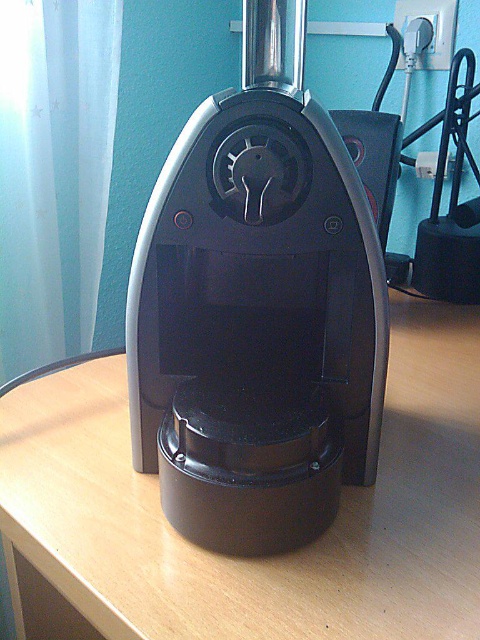
Between point (312, 304) and point (408, 621), which one is positioned behind?

The point (312, 304) is more distant.

Between black plastic coffee machine at center and wooden table at center, which one appears on the left side from the viewer's perspective?

Positioned to the left is black plastic coffee machine at center.

I want to click on black plastic coffee machine at center, so click(256, 312).